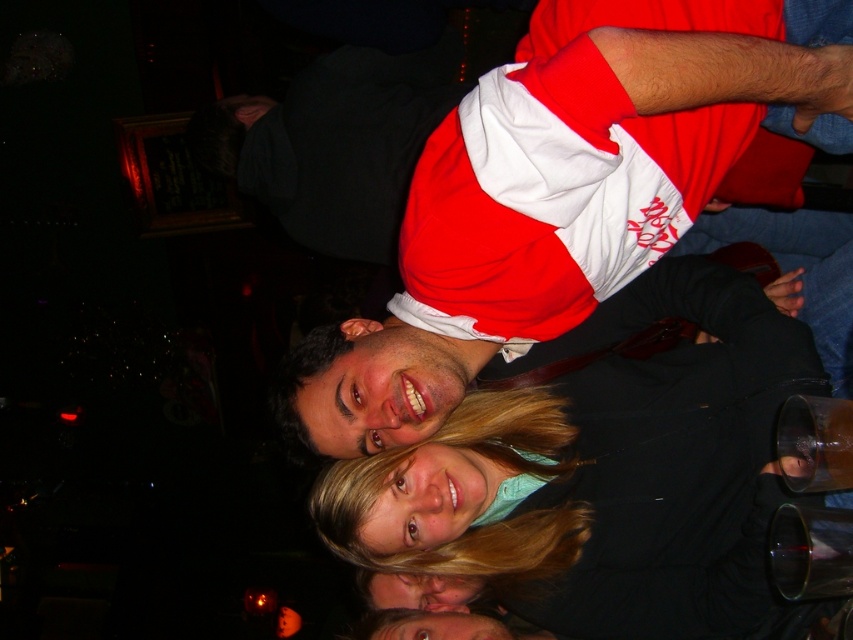
You are at a social event and want to take a photo of the matte black jacket at center and the red and white jersey at center. To ensure both are in frame, should you adjust your camera to the left or right?

The matte black jacket at center is positioned on the right side of the red and white jersey at center, so you should adjust your camera to the right to ensure both are in frame.

You are at a party and want to know which clothing item is smaller between the matte black jacket at center and the red and white jersey at center. Can you tell me?

The matte black jacket at center is smaller compared to the red and white jersey at center.